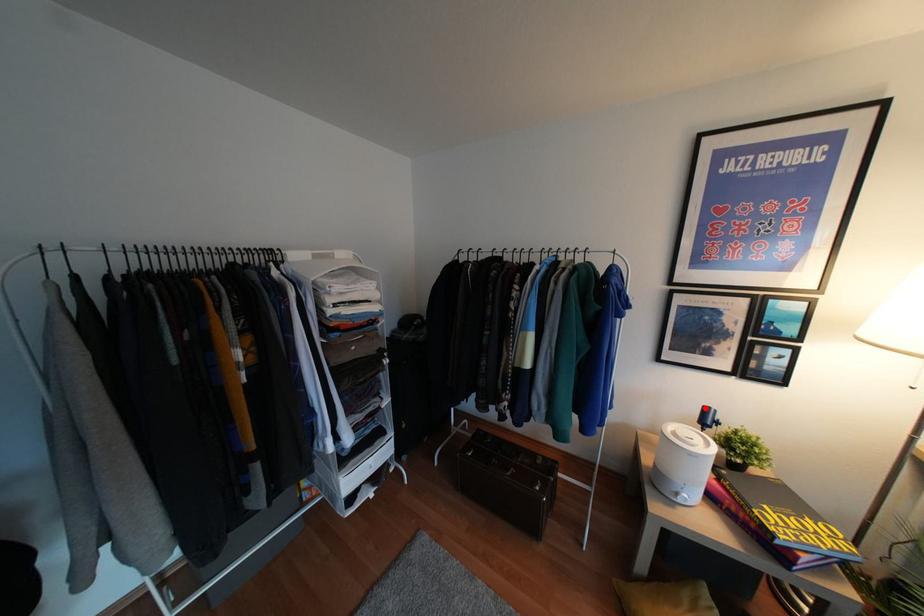
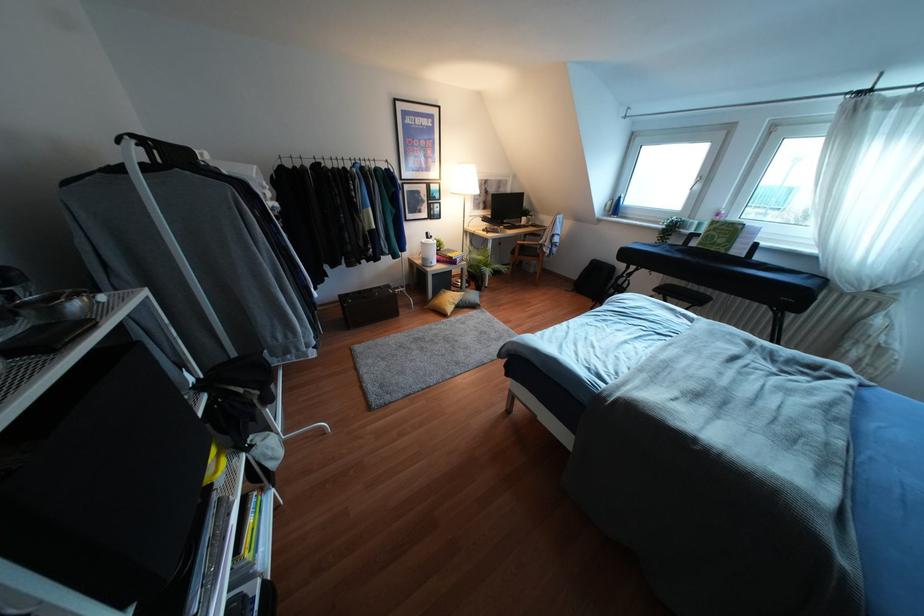
Question: A red point is marked in image1. In image2, is the corresponding 3D point closer to the camera or farther? Reply with the corresponding letter.

Choices:
 (A) The corresponding 3D point is closer.
 (B) The corresponding 3D point is farther.

Answer: (A)